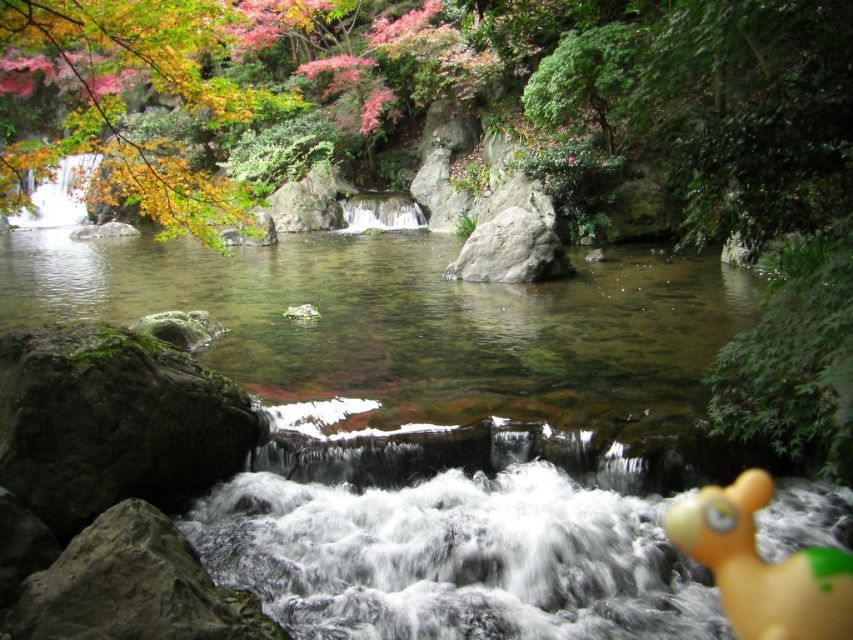
Question: Which object appears closest to the camera in this image?

Choices:
 (A) green mossy rock at lower left
 (B) gray rough rock at center

Answer: (A)

Question: Among these points, which one is nearest to the camera?

Choices:
 (A) click(16, 172)
 (B) click(194, 385)
 (C) click(781, 612)

Answer: (C)

Question: Which point is farther to the camera?

Choices:
 (A) green mossy rock at lower left
 (B) autumn leaves at upper left
 (C) yellow rubber duck at lower right

Answer: (B)

Question: Can you confirm if autumn leaves at upper left is positioned to the right of green mossy rock at lower left?

Choices:
 (A) yes
 (B) no

Answer: (B)

Question: Does autumn leaves at upper left have a greater width compared to green mossy rock at lower left?

Choices:
 (A) yes
 (B) no

Answer: (A)

Question: Is autumn leaves at upper left to the left of green mossy rock at lower left from the viewer's perspective?

Choices:
 (A) no
 (B) yes

Answer: (B)